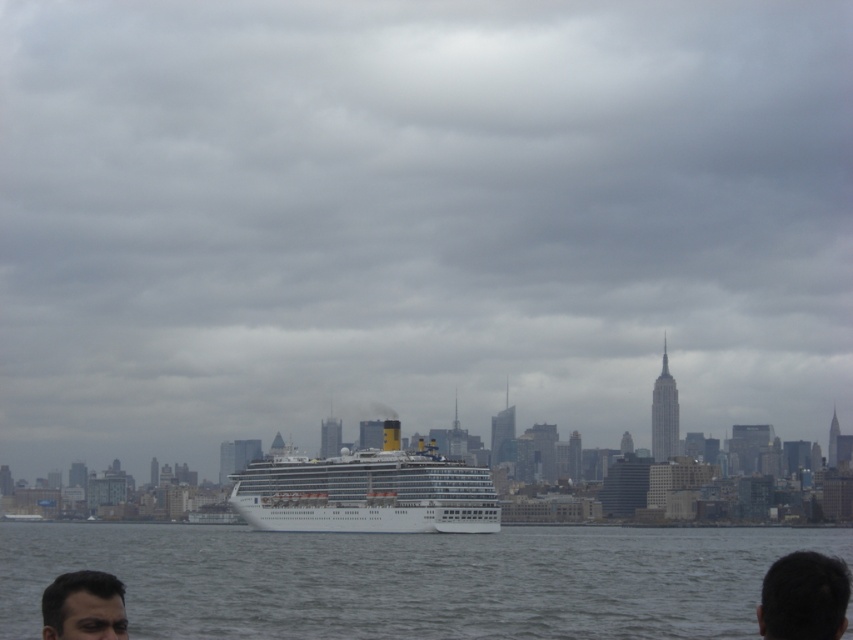
Question: Is white glossy cruise ship at center bigger than dark hair at lower right?

Choices:
 (A) no
 (B) yes

Answer: (A)

Question: Is white glossy cruise ship at center wider than dark brown hair at lower left?

Choices:
 (A) no
 (B) yes

Answer: (B)

Question: Which object is farther from the camera taking this photo?

Choices:
 (A) dark brown hair at lower left
 (B) gray water at center
 (C) dark hair at lower right

Answer: (B)

Question: Which of these objects is positioned closest to the gray water at center?

Choices:
 (A) dark hair at lower right
 (B) white glossy cruise ship at center

Answer: (B)

Question: Is dark hair at lower right positioned before dark brown hair at lower left?

Choices:
 (A) yes
 (B) no

Answer: (A)

Question: Which object is positioned closest to the dark hair at lower right?

Choices:
 (A) dark brown hair at lower left
 (B) gray water at center

Answer: (A)